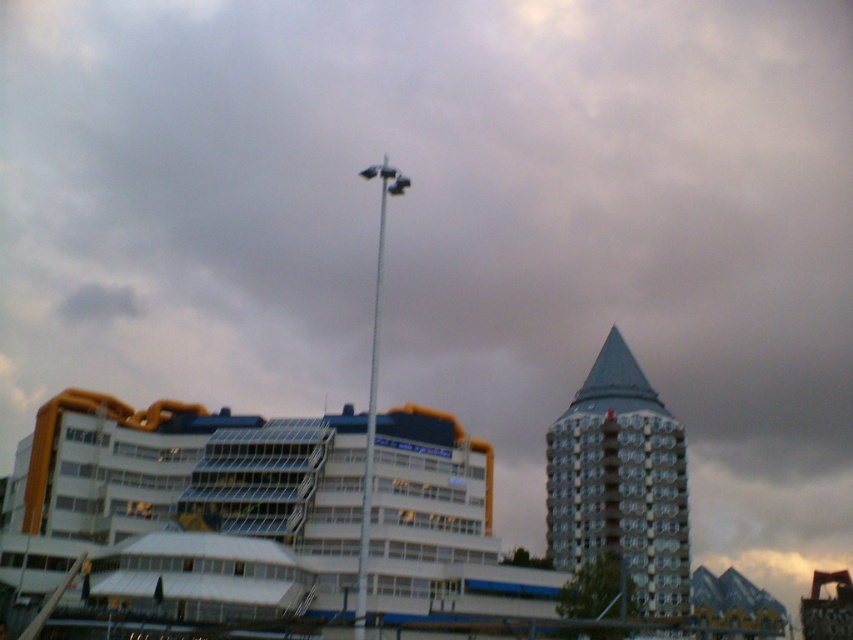
Does white glossy building at center appear under white metallic pole at center?

Yes, white glossy building at center is below white metallic pole at center.

Which is above, white glossy building at center or white metallic pole at center?

white metallic pole at center is above.

Who is more forward, (224, 483) or (364, 518)?

Point (364, 518)

Where is `white glossy building at center`? white glossy building at center is located at coordinates (189, 506).

This screenshot has height=640, width=853. What do you see at coordinates (189, 506) in the screenshot?
I see `white glossy building at center` at bounding box center [189, 506].

Who is shorter, white glossy building at center or blue glass tower at upper center?

With less height is white glossy building at center.

Where is `white glossy building at center`? This screenshot has width=853, height=640. white glossy building at center is located at coordinates (189, 506).

Between point (653, 545) and point (370, 172), which one is positioned behind?

Point (653, 545)

Between blue glass tower at upper center and white metallic pole at center, which one has more height?

Standing taller between the two is white metallic pole at center.

Which is behind, point (643, 548) or point (358, 621)?

Point (643, 548)

Where is `blue glass tower at upper center`? blue glass tower at upper center is located at coordinates (619, 481).